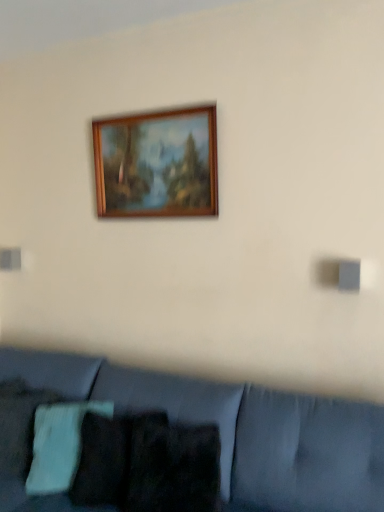
Where is `velvet blue couch at lower center`? velvet blue couch at lower center is located at coordinates (241, 430).

Locate an element on the screen. green knitted pillow at lower left is located at coordinates (59, 445).

Locate an element on the screen. The height and width of the screenshot is (512, 384). wooden frame at upper center is located at coordinates (157, 163).

Image resolution: width=384 pixels, height=512 pixels. I want to click on velvet blue couch at lower center, so pos(241,430).

Could green knitted pillow at lower left be considered to be inside wooden frame at upper center?

No, wooden frame at upper center does not contain green knitted pillow at lower left.

Is wooden frame at upper center facing away from green knitted pillow at lower left?

That's not correct — wooden frame at upper center is not looking away from green knitted pillow at lower left.

Based on the photo, between wooden frame at upper center and green knitted pillow at lower left, which one has less height?

With less height is green knitted pillow at lower left.

Consider the image. Is wooden frame at upper center thinner than green knitted pillow at lower left?

Yes.

Can you confirm if velvet blue couch at lower center is bigger than green knitted pillow at lower left?

Indeed, velvet blue couch at lower center has a larger size compared to green knitted pillow at lower left.

Which object is closer to the camera taking this photo, velvet blue couch at lower center or green knitted pillow at lower left?

velvet blue couch at lower center is in front.

I want to click on pillow lying above the velvet blue couch at lower center (from the image's perspective), so click(x=59, y=445).

Can you confirm if velvet blue couch at lower center is thinner than green knitted pillow at lower left?

No.

Is there a large distance between green knitted pillow at lower left and velvet blue couch at lower center?

No, there isn't a large distance between green knitted pillow at lower left and velvet blue couch at lower center.

Is green knitted pillow at lower left to the left or to the right of velvet blue couch at lower center in the image?

In the image, green knitted pillow at lower left appears on the left side of velvet blue couch at lower center.

Is green knitted pillow at lower left wider than velvet blue couch at lower center?

Incorrect, the width of green knitted pillow at lower left does not surpass that of velvet blue couch at lower center.

Relative to wooden frame at upper center, is velvet blue couch at lower center in front or behind?

Clearly, velvet blue couch at lower center is in front of wooden frame at upper center.

Which object is positioned more to the right, velvet blue couch at lower center or wooden frame at upper center?

velvet blue couch at lower center is more to the right.

Are velvet blue couch at lower center and wooden frame at upper center located far from each other?

Absolutely, velvet blue couch at lower center is distant from wooden frame at upper center.

In the scene shown: Can you confirm if green knitted pillow at lower left is taller than wooden frame at upper center?

No.

Based on the photo, considering the relative sizes of green knitted pillow at lower left and wooden frame at upper center in the image provided, is green knitted pillow at lower left bigger than wooden frame at upper center?

Correct, green knitted pillow at lower left is larger in size than wooden frame at upper center.

Which is in front, point (45, 409) or point (195, 186)?

Point (45, 409)

How many degrees apart are the facing directions of green knitted pillow at lower left and wooden frame at upper center?

16.9 degrees separate the facing orientations of green knitted pillow at lower left and wooden frame at upper center.

From the image's perspective, who appears lower, wooden frame at upper center or velvet blue couch at lower center?

velvet blue couch at lower center appears lower in the image.

Who is bigger, wooden frame at upper center or velvet blue couch at lower center?

velvet blue couch at lower center.

Does wooden frame at upper center have a lesser height compared to velvet blue couch at lower center?

Yes, wooden frame at upper center is shorter than velvet blue couch at lower center.

Would you say wooden frame at upper center is to the left or to the right of velvet blue couch at lower center in the picture?

Based on their positions, wooden frame at upper center is located to the left of velvet blue couch at lower center.

Locate an element on the screen. This screenshot has height=512, width=384. pillow in front of the wooden frame at upper center is located at coordinates (59, 445).

Find the location of a particular element. studio couch on the right of green knitted pillow at lower left is located at coordinates (241, 430).

From the picture: Considering their positions, is wooden frame at upper center positioned further to green knitted pillow at lower left than velvet blue couch at lower center?

Based on the image, wooden frame at upper center appears to be further to green knitted pillow at lower left.

Based on their spatial positions, is wooden frame at upper center or green knitted pillow at lower left closer to velvet blue couch at lower center?

green knitted pillow at lower left.

Looking at the image, which one is located closer to velvet blue couch at lower center, green knitted pillow at lower left or wooden frame at upper center?

green knitted pillow at lower left is closer to velvet blue couch at lower center.

Estimate the real-world distances between objects in this image. Which object is closer to green knitted pillow at lower left, velvet blue couch at lower center or wooden frame at upper center?

Among the two, velvet blue couch at lower center is located nearer to green knitted pillow at lower left.

From the image, which object appears to be farther from wooden frame at upper center, velvet blue couch at lower center or green knitted pillow at lower left?

The object further to wooden frame at upper center is green knitted pillow at lower left.

When comparing their distances from wooden frame at upper center, does green knitted pillow at lower left or velvet blue couch at lower center seem further?

green knitted pillow at lower left is further to wooden frame at upper center.

You are a GUI agent. You are given a task and a screenshot of the screen. Output one action in this format:
    pyautogui.click(x=<x>, y=<y>)
    Task: Click on the pillow between wooden frame at upper center and velvet blue couch at lower center vertically
    The image size is (384, 512).
    Given the screenshot: What is the action you would take?
    pyautogui.click(x=59, y=445)